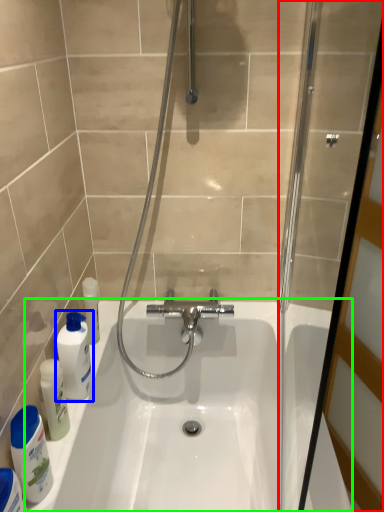
Question: Based on their relative distances, which object is farther from screen door (highlighted by a red box)? Choose from mouthwash (highlighted by a blue box) and bath (highlighted by a green box).

Choices:
 (A) mouthwash
 (B) bath

Answer: (A)